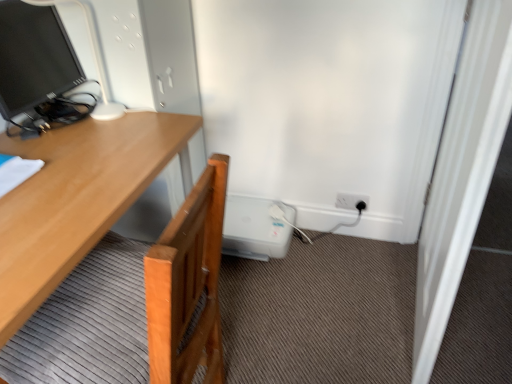
Question: From a real-world perspective, is black plastic power outlet at lower right located higher than white wooden screen door at right?

Choices:
 (A) no
 (B) yes

Answer: (A)

Question: Is black plastic power outlet at lower right not close to white wooden screen door at right?

Choices:
 (A) yes
 (B) no

Answer: (B)

Question: Does black plastic power outlet at lower right turn towards white wooden screen door at right?

Choices:
 (A) no
 (B) yes

Answer: (A)

Question: Can you confirm if black plastic power outlet at lower right is bigger than white wooden screen door at right?

Choices:
 (A) no
 (B) yes

Answer: (A)

Question: Is black plastic power outlet at lower right touching white wooden screen door at right?

Choices:
 (A) no
 (B) yes

Answer: (A)

Question: Visually, is matte black monitor at upper left positioned to the left or to the right of light wood desk at left?

Choices:
 (A) right
 (B) left

Answer: (B)

Question: Is matte black monitor at upper left wider or thinner than light wood desk at left?

Choices:
 (A) thin
 (B) wide

Answer: (A)

Question: Is matte black monitor at upper left spatially inside light wood desk at left, or outside of it?

Choices:
 (A) outside
 (B) inside

Answer: (A)

Question: In the image, is matte black monitor at upper left positioned in front of or behind light wood desk at left?

Choices:
 (A) front
 (B) behind

Answer: (B)

Question: Would you say white wooden screen door at right is inside or outside light wood desk at left?

Choices:
 (A) inside
 (B) outside

Answer: (B)

Question: Visually, is white wooden screen door at right positioned to the left or to the right of light wood desk at left?

Choices:
 (A) right
 (B) left

Answer: (A)

Question: In the image, is white wooden screen door at right positioned in front of or behind light wood desk at left?

Choices:
 (A) behind
 (B) front

Answer: (A)

Question: Looking at their shapes, would you say white wooden screen door at right is wider or thinner than light wood desk at left?

Choices:
 (A) wide
 (B) thin

Answer: (B)

Question: Is light wood desk at left wider or thinner than white wooden screen door at right?

Choices:
 (A) wide
 (B) thin

Answer: (A)

Question: From a real-world perspective, is light wood desk at left positioned above or below white wooden screen door at right?

Choices:
 (A) above
 (B) below

Answer: (B)